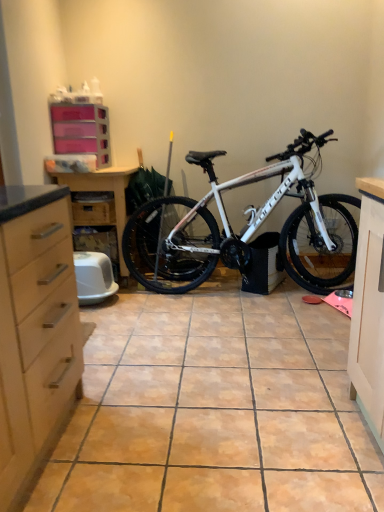
Question: Is wooden drawer at center-left not close to matte wood dresser at left?

Choices:
 (A) yes
 (B) no

Answer: (B)

Question: Is wooden drawer at center-left closer to camera compared to matte wood dresser at left?

Choices:
 (A) no
 (B) yes

Answer: (A)

Question: Is wooden drawer at center-left smaller than matte wood dresser at left?

Choices:
 (A) no
 (B) yes

Answer: (B)

Question: Considering the relative positions of wooden drawer at center-left and matte wood dresser at left in the image provided, is wooden drawer at center-left to the right of matte wood dresser at left from the viewer's perspective?

Choices:
 (A) no
 (B) yes

Answer: (A)

Question: Is wooden drawer at center-left with matte wood dresser at left?

Choices:
 (A) no
 (B) yes

Answer: (A)

Question: From the image's perspective, relative to wooden drawer at center-left, is white matte bicycle at center above or below?

Choices:
 (A) above
 (B) below

Answer: (B)

Question: Is white matte bicycle at center bigger or smaller than wooden drawer at center-left?

Choices:
 (A) small
 (B) big

Answer: (B)

Question: In the image, is white matte bicycle at center on the left side or the right side of wooden drawer at center-left?

Choices:
 (A) right
 (B) left

Answer: (A)

Question: In terms of height, does white matte bicycle at center look taller or shorter compared to wooden drawer at center-left?

Choices:
 (A) tall
 (B) short

Answer: (A)

Question: From a real-world perspective, is white matte bicycle at center positioned above or below pink plastic drawers at upper left?

Choices:
 (A) above
 (B) below

Answer: (B)

Question: Is white matte bicycle at center taller or shorter than pink plastic drawers at upper left?

Choices:
 (A) short
 (B) tall

Answer: (B)

Question: Would you say white matte bicycle at center is to the left or to the right of pink plastic drawers at upper left in the picture?

Choices:
 (A) right
 (B) left

Answer: (A)

Question: Looking at the image, does white matte bicycle at center seem bigger or smaller compared to pink plastic drawers at upper left?

Choices:
 (A) big
 (B) small

Answer: (A)

Question: In terms of size, does wooden drawer at center-left appear bigger or smaller than white matte bicycle at center?

Choices:
 (A) big
 (B) small

Answer: (B)

Question: From the image's perspective, relative to white matte bicycle at center, is wooden drawer at center-left above or below?

Choices:
 (A) below
 (B) above

Answer: (B)